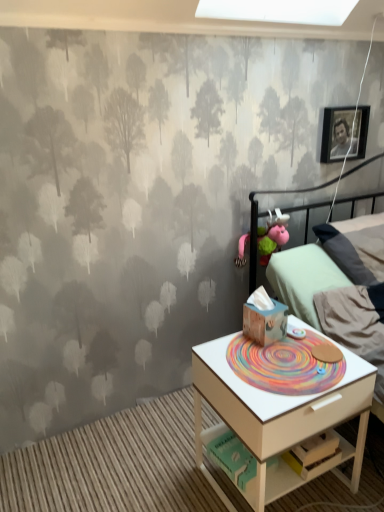
Question: Do you think matte black picture frame at upper right is within white wood nightstand at lower right, or outside of it?

Choices:
 (A) inside
 (B) outside

Answer: (B)

Question: In the image, is matte black picture frame at upper right positioned in front of or behind white wood nightstand at lower right?

Choices:
 (A) behind
 (B) front

Answer: (A)

Question: Which of these objects is positioned closest to the wooden tissue box at center, placed as the 1th toy when sorted from front to back?

Choices:
 (A) matte black picture frame at upper right
 (B) pink fabric stuffed animal at upper right, which appears as the 2th toy when viewed from the front
 (C) white wood drawer at lower right
 (D) white wood nightstand at lower right
 (E) light green fabric bed at right

Answer: (D)

Question: Estimate the real-world distances between objects in this image. Which object is farther from the wooden tissue box at center, placed as the 1th toy when sorted from bottom to top?

Choices:
 (A) white wood drawer at lower right
 (B) light green fabric bed at right
 (C) white wood nightstand at lower right
 (D) matte black picture frame at upper right
 (E) pink fabric stuffed animal at upper right, the 1th toy from the top

Answer: (D)